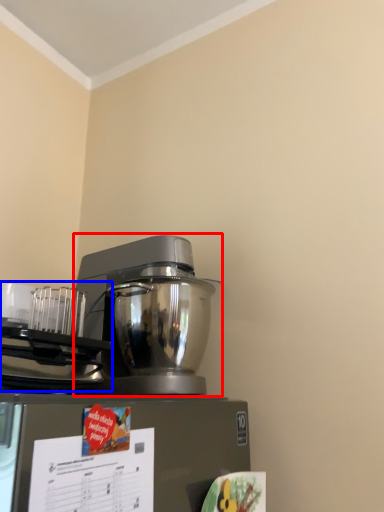
Question: Which of the following is the farthest to the observer, mixer (highlighted by a red box) or appliance (highlighted by a blue box)?

Choices:
 (A) mixer
 (B) appliance

Answer: (A)